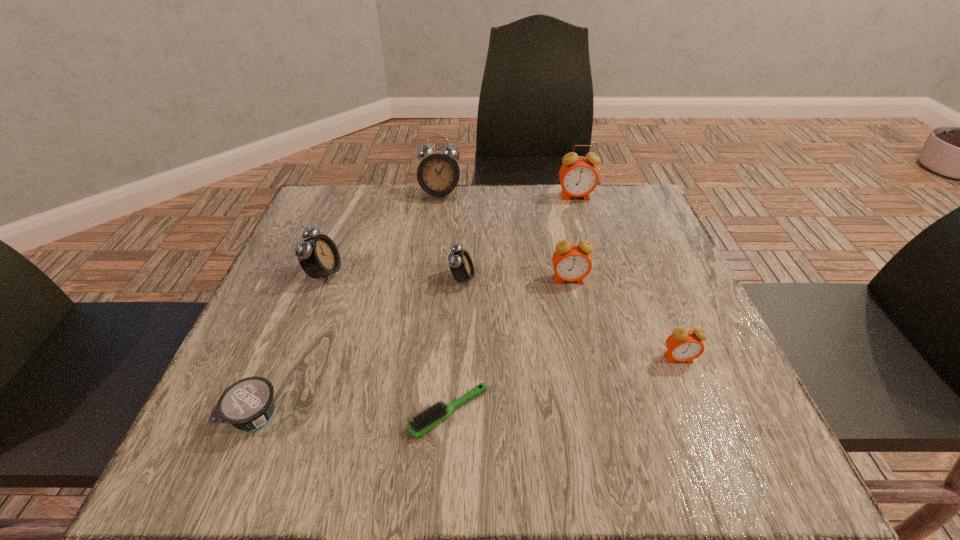
Where is `vacant space that is in between the farthest white alarm clock and the shortest object`? Image resolution: width=960 pixels, height=540 pixels. vacant space that is in between the farthest white alarm clock and the shortest object is located at coordinates (444, 303).

Identify which object is the fourth closest to the biggest white alarm clock. Please provide its 2D coordinates. Your answer should be formatted as a tuple, i.e. [(x, y)], where the tuple contains the x and y coordinates of a point satisfying the conditions above.

[(571, 261)]

Select which object appears as the fourth closest to the nearest pink alarm clock. Please provide its 2D coordinates. Your answer should be formatted as a tuple, i.e. [(x, y)], where the tuple contains the x and y coordinates of a point satisfying the conditions above.

[(578, 176)]

Identify which alarm clock is the nearest to the nearest pink alarm clock. Please provide its 2D coordinates. Your answer should be formatted as a tuple, i.e. [(x, y)], where the tuple contains the x and y coordinates of a point satisfying the conditions above.

[(571, 261)]

Locate which alarm clock ranks fourth in proximity to the rightmost pink alarm clock. Please provide its 2D coordinates. Your answer should be formatted as a tuple, i.e. [(x, y)], where the tuple contains the x and y coordinates of a point satisfying the conditions above.

[(438, 174)]

Find the location of a particular element. white alarm clock that is the third closest one to the rightmost alarm clock is located at coordinates (318, 256).

The image size is (960, 540). Identify the location of white alarm clock identified as the closest to the second smallest pink alarm clock. (460, 263).

Choose which pink alarm clock is the second nearest neighbor to the farthest white alarm clock. Please provide its 2D coordinates. Your answer should be formatted as a tuple, i.e. [(x, y)], where the tuple contains the x and y coordinates of a point satisfying the conditions above.

[(571, 261)]

Identify the location of pink alarm clock that is the second closest one to the biggest pink alarm clock. (683, 345).

The width and height of the screenshot is (960, 540). In order to click on vacant space that satisfies the following two spatial constraints: 1. on the face of the farthest white alarm clock; 2. on the face of the second biggest white alarm clock in this screenshot , I will do `click(430, 273)`.